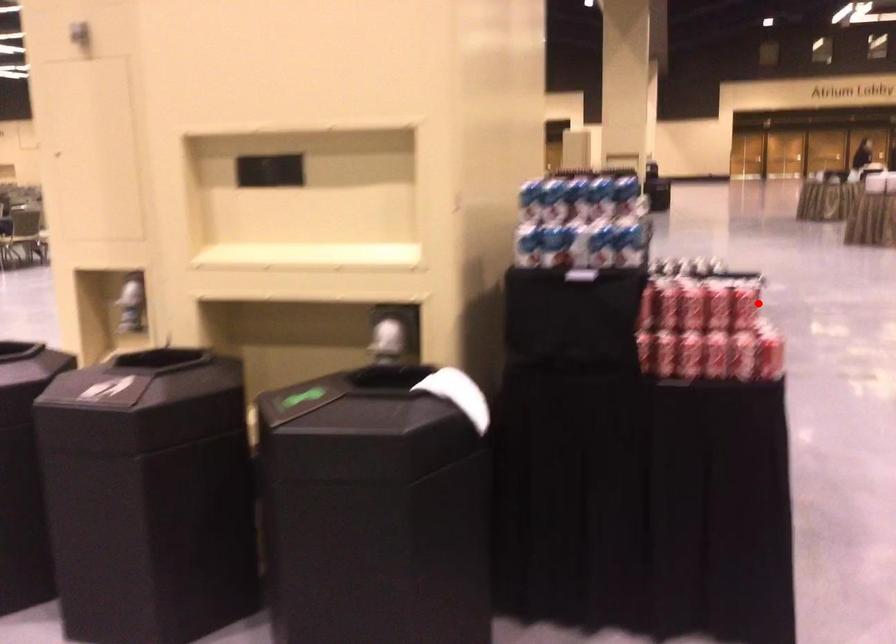
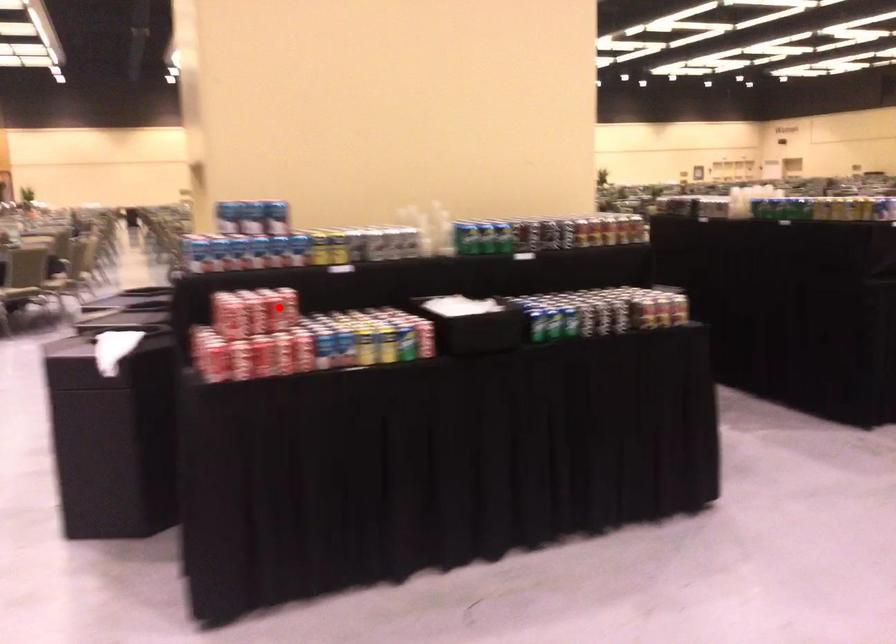
I am providing you with two images of the same scene from different viewpoints. A red point is marked on the first image and another point is marked on the second image. Does the point marked in image1 correspond to the same location as the one in image2?

No